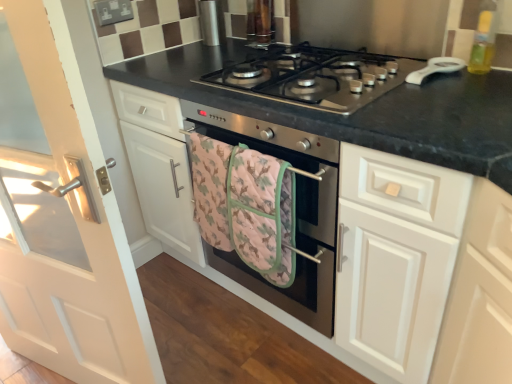
Question: In terms of height, does stainless steel gas stove at center look taller or shorter compared to pink quilted towel at center?

Choices:
 (A) tall
 (B) short

Answer: (B)

Question: In the image, is stainless steel gas stove at center on the left side or the right side of pink quilted towel at center?

Choices:
 (A) left
 (B) right

Answer: (B)

Question: Based on their relative distances, which object is farther from the stainless steel gas stove at center?

Choices:
 (A) pink quilted towel at center
 (B) stainless steel oven at center
 (C) white glossy door at left
 (D) black granite countertop at center

Answer: (C)

Question: Estimate the real-world distances between objects in this image. Which object is closer to the white glossy door at left?

Choices:
 (A) stainless steel oven at center
 (B) pink quilted towel at center
 (C) stainless steel gas stove at center
 (D) black granite countertop at center

Answer: (B)